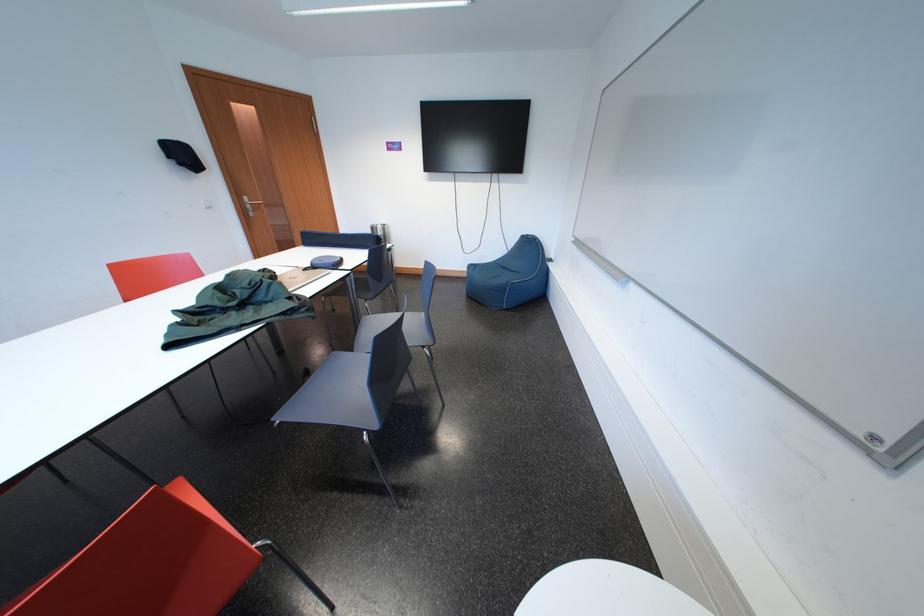
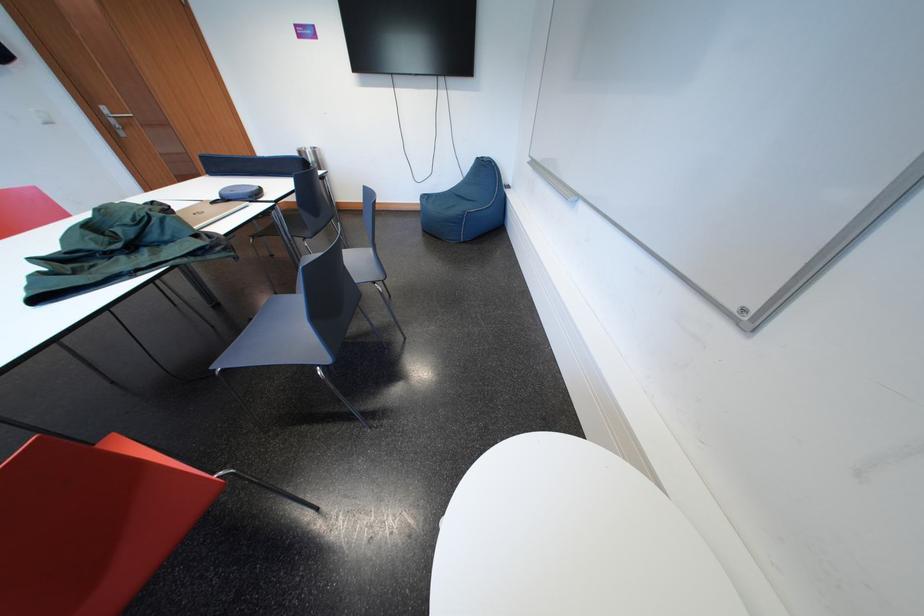
The point at [383,233] is marked in the first image. Where is the corresponding point in the second image?

(310, 158)